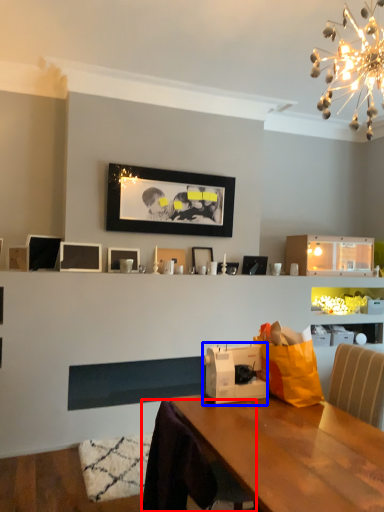
Question: Which object is further to the camera taking this photo, swivel chair (highlighted by a red box) or appliance (highlighted by a blue box)?

Choices:
 (A) swivel chair
 (B) appliance

Answer: (B)